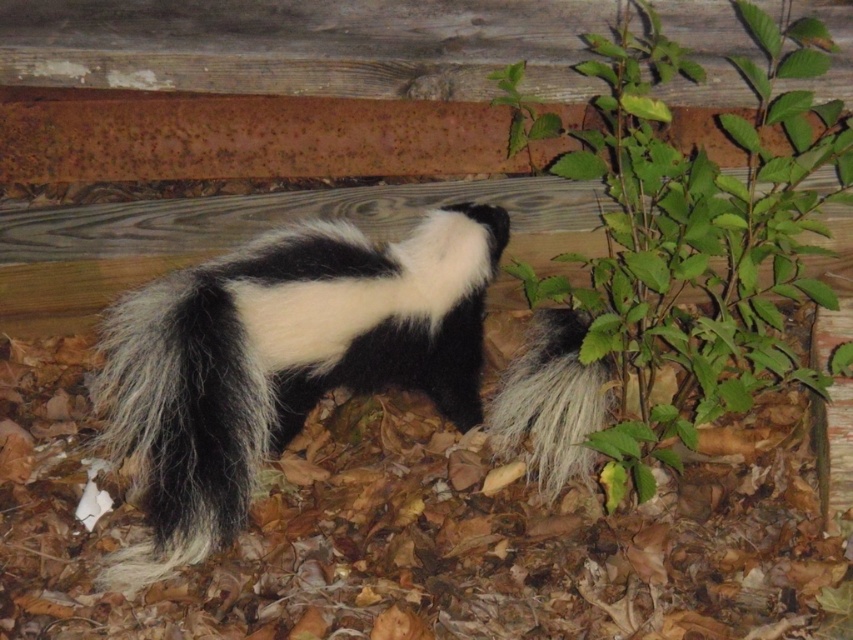
You are standing at the point with coordinates point (281, 360) in the image. Based on the scene description, what color is the fur of the animal you are currently on?

The point (281, 360) is on the black and white fur skunk at center, so the fur at that location is either black or white.

You are an animal photographer trying to capture a closeup of the black and white fur skunk at center and the green leafy plant at center right. Which subject will require you to zoom in more to fill the frame, considering their sizes?

The black and white fur skunk at center will require zooming in more because it occupies less space than the green leafy plant at center right, meaning it is smaller and needs a closer focus to fill the frame.

You are a photographer aiming to capture the black and white fur skunk at center and the green leafy plant at center right in the same frame. Based on their heights, which one will appear taller in the photo?

The green leafy plant at center right is taller than the black and white fur skunk at center, so it will appear taller in the photo.